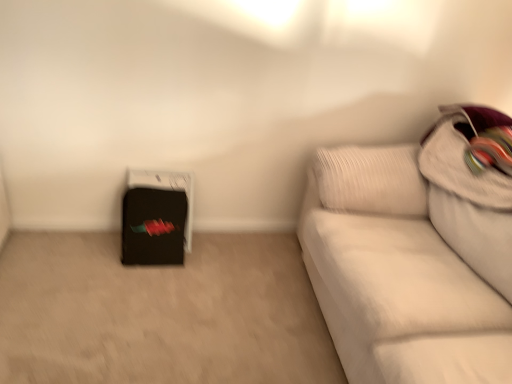
Question: In terms of height, does white textured pillow at upper right look taller or shorter compared to white fabric couch at right?

Choices:
 (A) short
 (B) tall

Answer: (A)

Question: From the image's perspective, relative to white fabric couch at right, is white textured pillow at upper right above or below?

Choices:
 (A) below
 (B) above

Answer: (B)

Question: Estimate the real-world distances between objects in this image. Which object is farther from the black matte suitcase at lower left?

Choices:
 (A) white textured pillow at upper right
 (B) white fabric couch at right

Answer: (A)

Question: Which object is positioned closest to the black matte suitcase at lower left?

Choices:
 (A) white fabric couch at right
 (B) white textured pillow at upper right

Answer: (A)